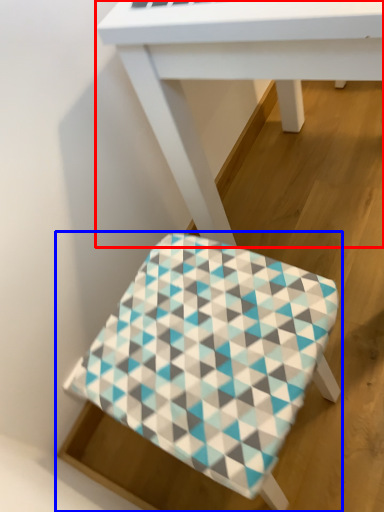
Question: Which of the following is the farthest to the observer, table (highlighted by a red box) or stool (highlighted by a blue box)?

Choices:
 (A) table
 (B) stool

Answer: (B)